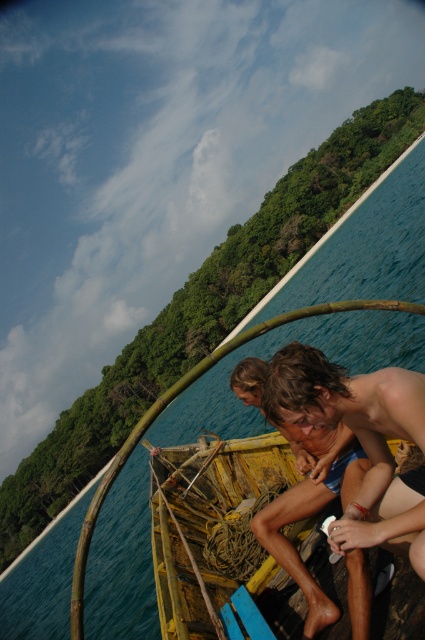
Is yellow weathered wood boat at center smaller than shiny brown hair at center?

No.

Which is more to the left, yellow weathered wood boat at center or shiny brown hair at center?

yellow weathered wood boat at center is more to the left.

Does point (271, 440) come in front of point (365, 376)?

No, (271, 440) is behind (365, 376).

Identify the location of yellow weathered wood boat at center. coord(210,525).